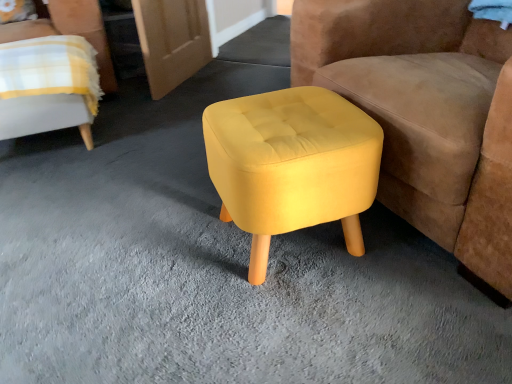
Question: Is yellow fabric stool at center surrounded by yellow fabric chair at upper left, which is counted as the 1th chair, starting from the left?

Choices:
 (A) yes
 (B) no

Answer: (B)

Question: Is yellow fabric chair at upper left, which is counted as the 1th chair, starting from the left, aimed at yellow fabric stool at center?

Choices:
 (A) yes
 (B) no

Answer: (B)

Question: Can you confirm if yellow fabric chair at upper left, which is counted as the 1th chair, starting from the left, is thinner than yellow fabric stool at center?

Choices:
 (A) no
 (B) yes

Answer: (A)

Question: From a real-world perspective, does yellow fabric chair at upper left, marked as the second chair in a right-to-left arrangement, sit lower than yellow fabric stool at center?

Choices:
 (A) yes
 (B) no

Answer: (B)

Question: Does yellow fabric chair at upper left, marked as the second chair in a right-to-left arrangement, appear on the left side of yellow fabric stool at center?

Choices:
 (A) no
 (B) yes

Answer: (B)

Question: From a real-world perspective, is yellow fabric stool at center physically located above or below yellow fabric ottoman at center?

Choices:
 (A) above
 (B) below

Answer: (A)

Question: From the image's perspective, is yellow fabric stool at center located above or below yellow fabric ottoman at center?

Choices:
 (A) above
 (B) below

Answer: (B)

Question: In the image, is yellow fabric stool at center positioned in front of or behind yellow fabric ottoman at center?

Choices:
 (A) behind
 (B) front

Answer: (B)

Question: Based on their positions, is yellow fabric stool at center located to the left or right of yellow fabric ottoman at center?

Choices:
 (A) left
 (B) right

Answer: (A)

Question: Considering the positions of yellow fabric stool at center and yellow fabric ottoman at center, arranged as the second chair when viewed from the left, in the image, is yellow fabric stool at center wider or thinner than yellow fabric ottoman at center, arranged as the second chair when viewed from the left,?

Choices:
 (A) wide
 (B) thin

Answer: (B)

Question: Is yellow fabric stool at center in front of or behind yellow fabric ottoman at center, arranged as the first chair when viewed from the right, in the image?

Choices:
 (A) front
 (B) behind

Answer: (B)

Question: Would you say yellow fabric stool at center is inside or outside yellow fabric ottoman at center, arranged as the first chair when viewed from the right?

Choices:
 (A) inside
 (B) outside

Answer: (B)

Question: Would you say yellow fabric stool at center is to the left or to the right of yellow fabric ottoman at center, arranged as the first chair when viewed from the right, in the picture?

Choices:
 (A) right
 (B) left

Answer: (B)

Question: Relative to yellow fabric chair at upper left, which is counted as the 1th chair, starting from the left, is yellow fabric ottoman at center in front or behind?

Choices:
 (A) front
 (B) behind

Answer: (B)

Question: From their relative heights in the image, would you say yellow fabric ottoman at center is taller or shorter than yellow fabric chair at upper left, marked as the second chair in a right-to-left arrangement?

Choices:
 (A) tall
 (B) short

Answer: (B)